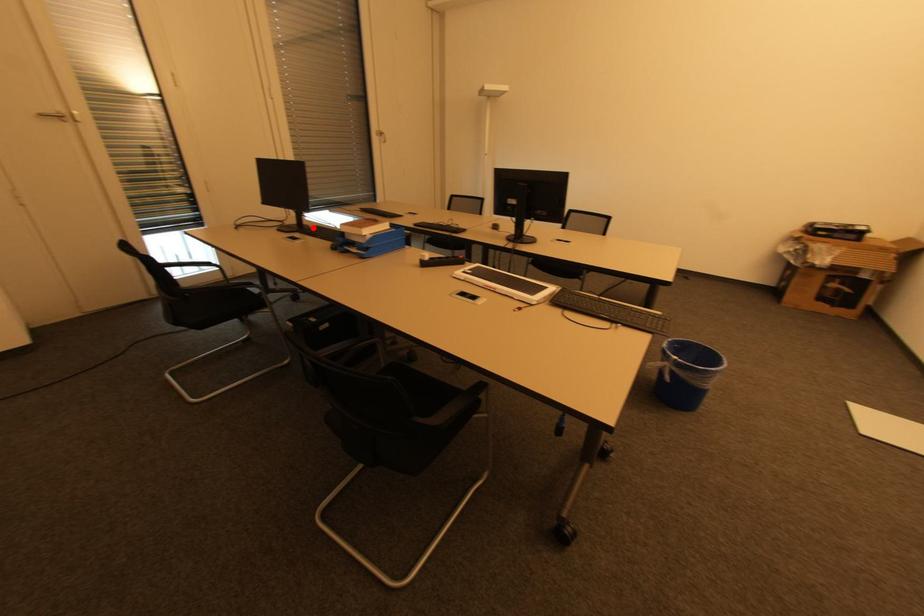
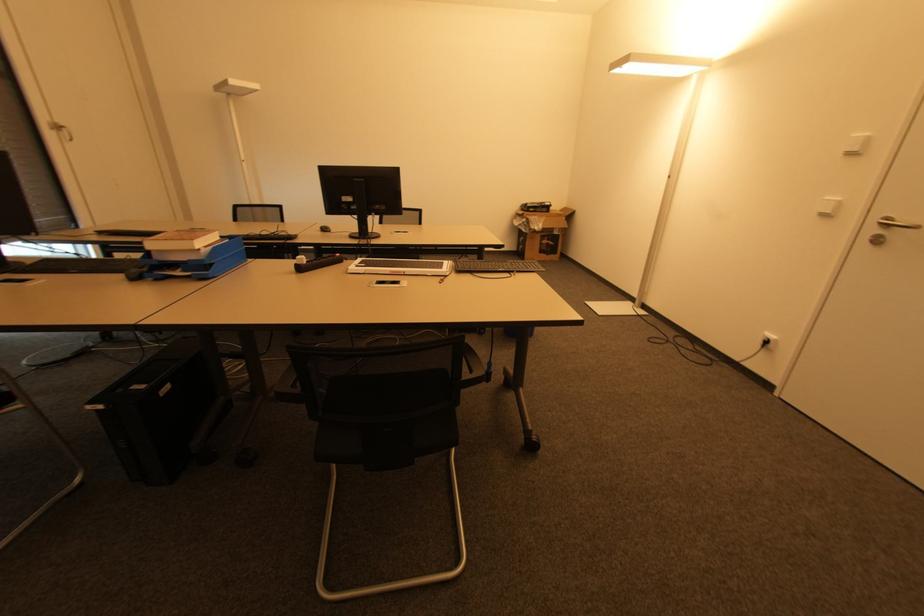
Question: A red point is marked in image1. In image2, is the corresponding 3D point closer to the camera or farther? Reply with the corresponding letter.

Choices:
 (A) The corresponding 3D point is closer.
 (B) The corresponding 3D point is farther.

Answer: (B)